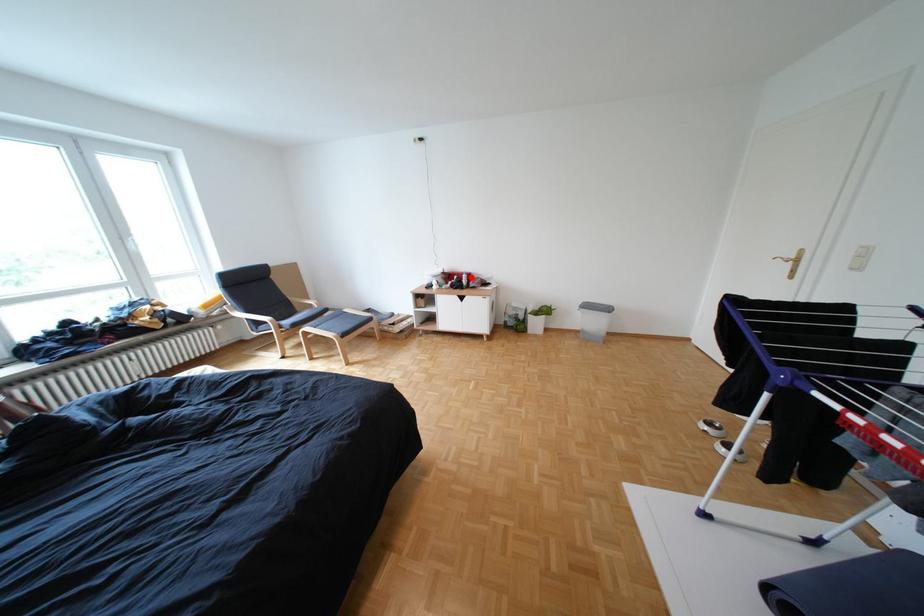
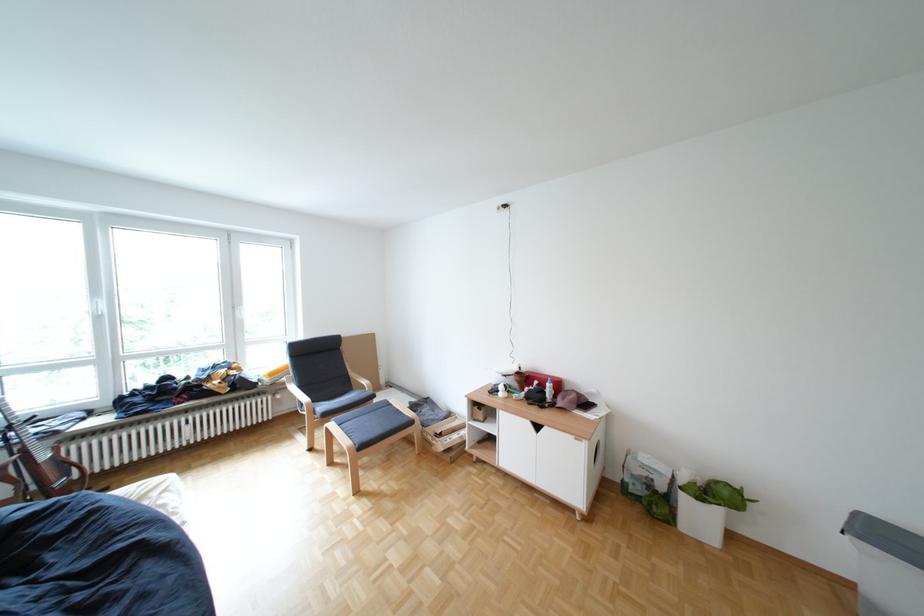
Where in the second image is the point corresponding to the highlighted location from the first image?

(552, 383)